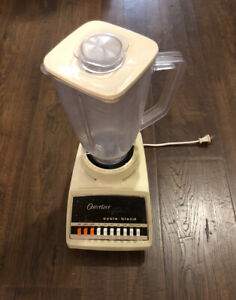
Where is `power cord`? power cord is located at coordinates (194, 142).